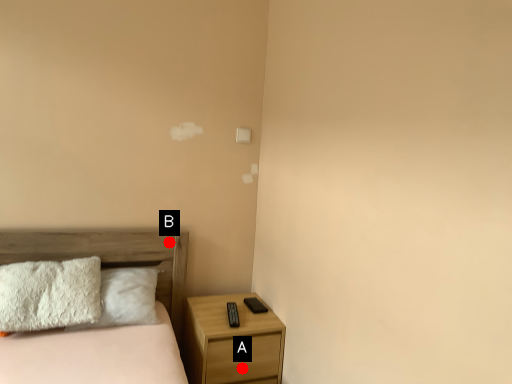
Question: Two points are circled on the image, labeled by A and B beside each circle. Which point is farther from the camera taking this photo?

Choices:
 (A) A is further
 (B) B is further

Answer: (B)